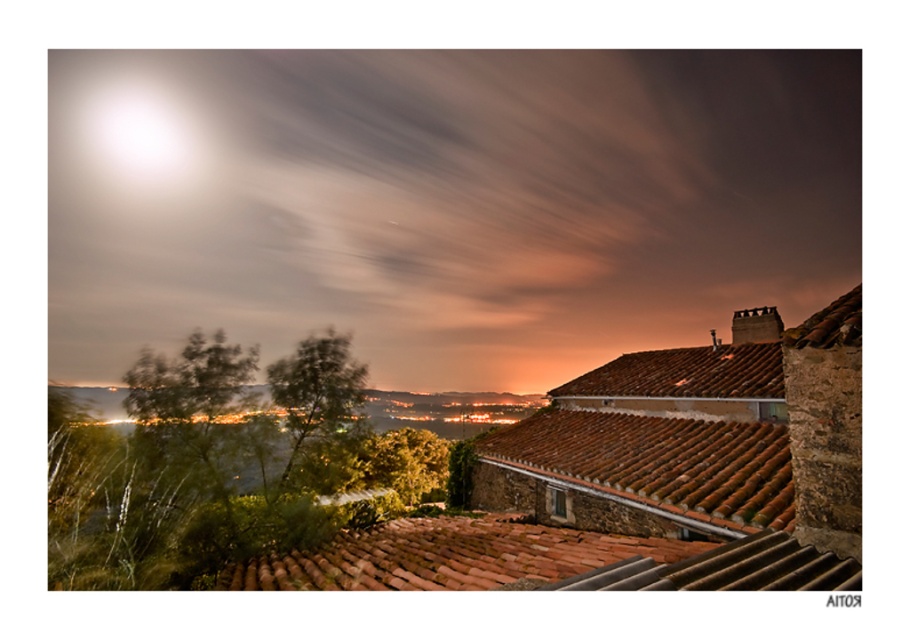
Measure the distance between matte orange cloud at upper center and camera.

18.09 meters

Measure the distance from matte orange cloud at upper center to brown tile roof at upper right.

matte orange cloud at upper center is 48.51 meters away from brown tile roof at upper right.

Between point (476, 161) and point (726, 353), which one is positioned in front?

Point (726, 353)

You are a GUI agent. You are given a task and a screenshot of the screen. Output one action in this format:
    pyautogui.click(x=<x>, y=<y>)
    Task: Click on the matte orange cloud at upper center
    This screenshot has height=640, width=910.
    Given the screenshot: What is the action you would take?
    [443, 202]

Is reddish-brown clay tiles at center wider than brown tile roof at upper right?

In fact, reddish-brown clay tiles at center might be narrower than brown tile roof at upper right.

Find the location of a particular element. The image size is (910, 640). reddish-brown clay tiles at center is located at coordinates (448, 556).

Can you confirm if matte orange cloud at upper center is taller than reddish-brown clay tiles at center?

Indeed, matte orange cloud at upper center has a greater height compared to reddish-brown clay tiles at center.

Based on the photo, measure the distance between matte orange cloud at upper center and camera.

matte orange cloud at upper center and camera are 59.34 feet apart from each other.

The image size is (910, 640). In order to click on matte orange cloud at upper center in this screenshot , I will do click(x=443, y=202).